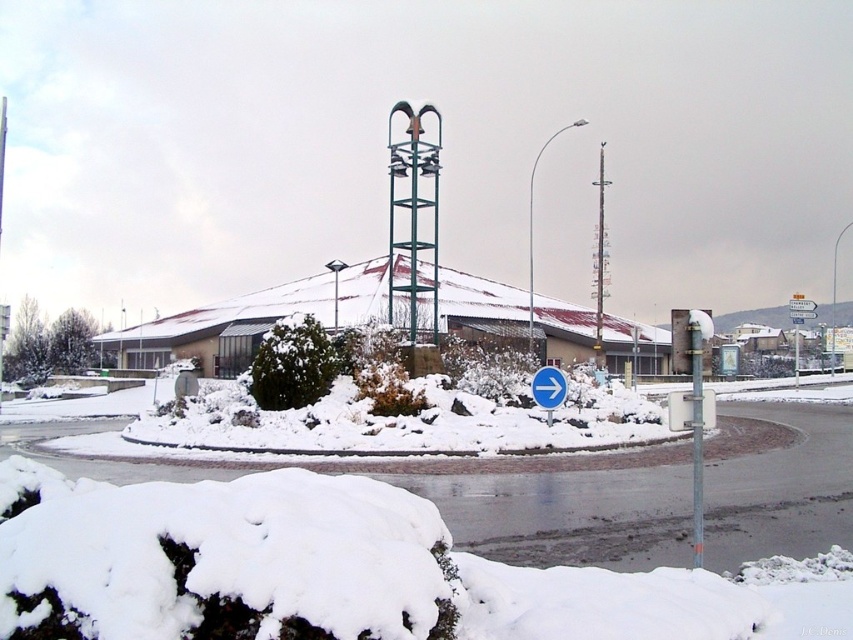
From the picture: Who is more distant from viewer, (701, 337) or (560, 385)?

Point (560, 385)

Locate an element on the screen. This screenshot has width=853, height=640. metallic pole at center is located at coordinates (695, 435).

Find the location of a particular element. This screenshot has height=640, width=853. metallic pole at center is located at coordinates (695, 435).

Is green metal tower at center to the left of metallic pole at center from the viewer's perspective?

Correct, you'll find green metal tower at center to the left of metallic pole at center.

Is point (437, 321) positioned before point (692, 490)?

No, it is behind (692, 490).

Where is `green metal tower at center`? green metal tower at center is located at coordinates (413, 209).

Is green metal tower at center behind white plastic arrow at center?

Yes, it is behind white plastic arrow at center.

Is green metal tower at center closer to the viewer compared to white plastic arrow at center?

No.

The image size is (853, 640). Describe the element at coordinates (413, 209) in the screenshot. I see `green metal tower at center` at that location.

Identify the location of green metal tower at center. (413, 209).